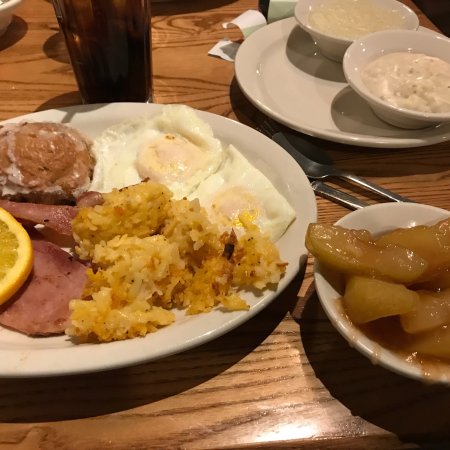
The height and width of the screenshot is (450, 450). I want to click on bowl, so click(x=314, y=28).